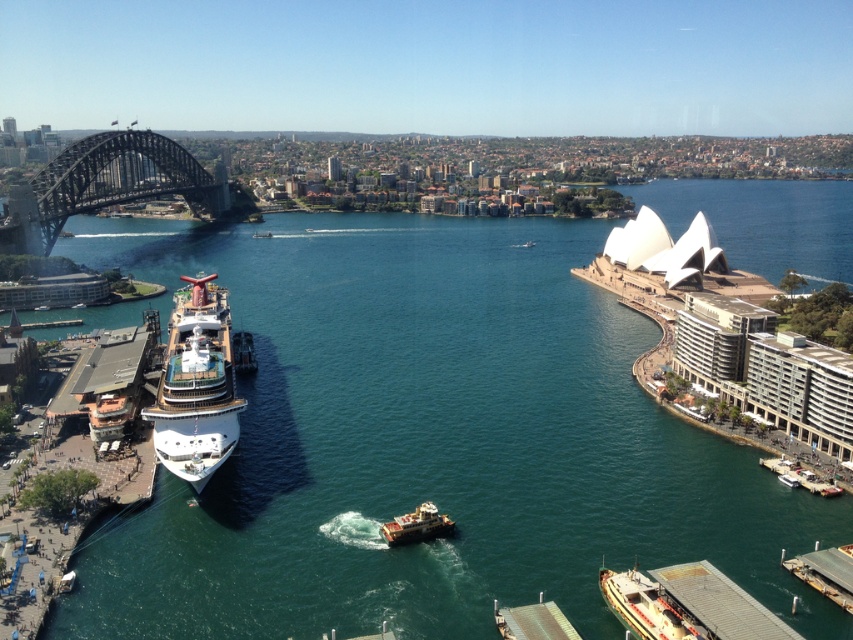
Is the position of white glossy cruise ship at center less distant than that of metallic gray boat at lower right?

That is False.

Where is `white glossy cruise ship at center`? The width and height of the screenshot is (853, 640). white glossy cruise ship at center is located at coordinates (196, 387).

Measure the distance from dark steel bridge at left to metallic gray boat at lower right.

The distance of dark steel bridge at left from metallic gray boat at lower right is 262.03 meters.

Is dark steel bridge at left positioned at the back of metallic gray boat at lower right?

Yes, dark steel bridge at left is further from the viewer.

The height and width of the screenshot is (640, 853). What are the coordinates of `dark steel bridge at left` in the screenshot? It's located at (106, 184).

Locate an element on the screen. dark steel bridge at left is located at coordinates pos(106,184).

Does point (643, 634) lie behind point (428, 513)?

No, (643, 634) is closer to viewer.

Is metallic gray boat at lower right bigger than white plastic boat at center?

Yes.

Where is `metallic gray boat at lower right`? metallic gray boat at lower right is located at coordinates (643, 605).